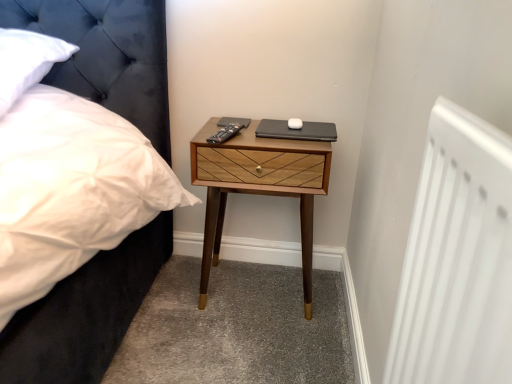
This screenshot has height=384, width=512. I want to click on free space above woodendrawer at center (from a real-world perspective), so click(266, 124).